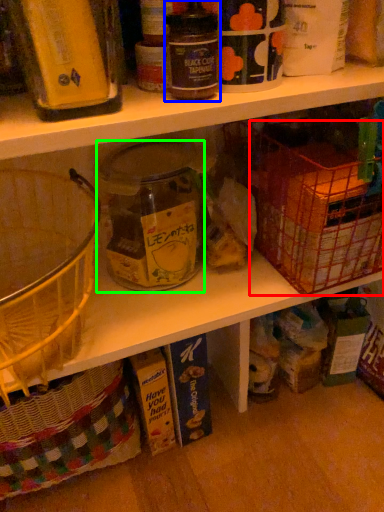
Question: Considering the real-world distances, which object is farthest from basket (highlighted by a red box)? bottle (highlighted by a blue box) or glass jar (highlighted by a green box)?

Choices:
 (A) bottle
 (B) glass jar

Answer: (A)